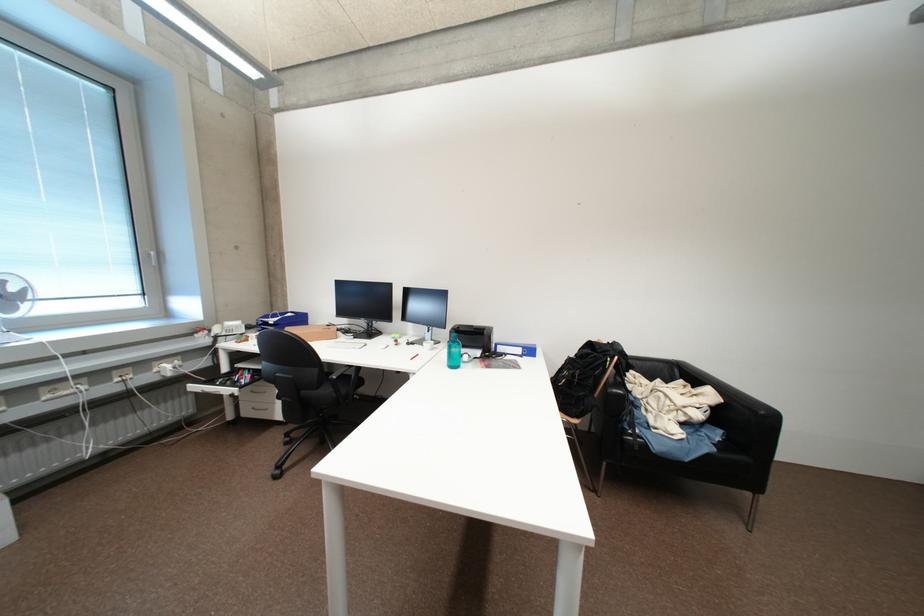
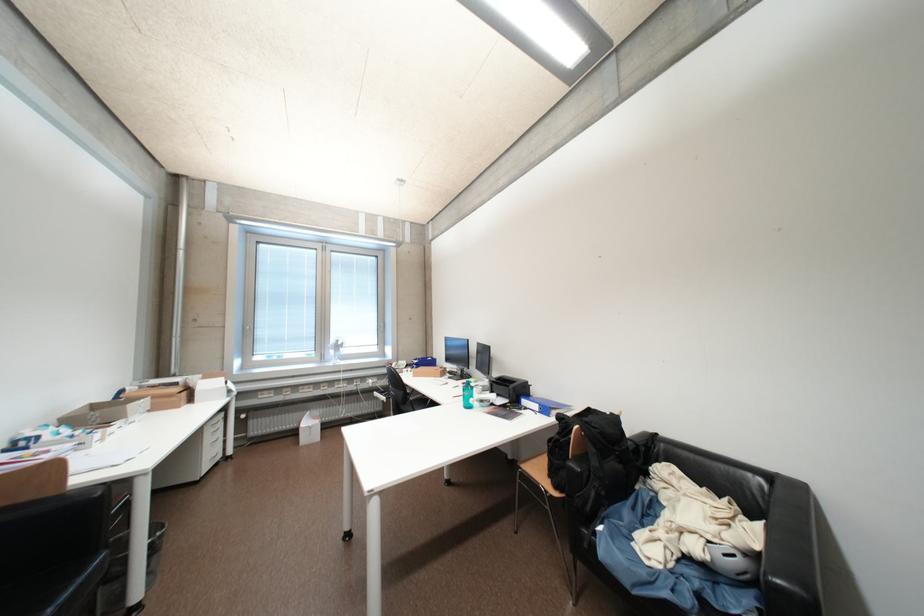
Question: I am providing you with two images of the same scene from different viewpoints. Please identify which objects are invisible in image2.

Choices:
 (A) blue ring binder
 (B) chair sitting surface
 (C) dark wall switch
 (D) chair armrest

Answer: (B)